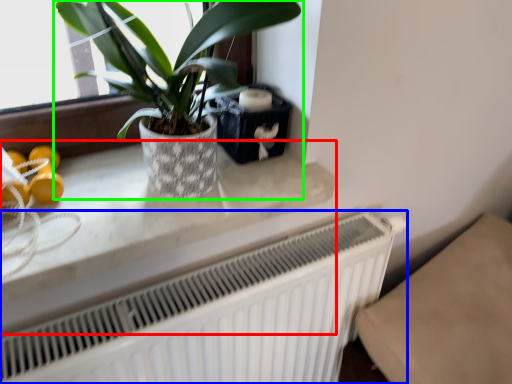
Question: Estimate the real-world distances between objects in this image. Which object is closer to counter top (highlighted by a red box), radiator (highlighted by a blue box) or houseplant (highlighted by a green box)?

Choices:
 (A) radiator
 (B) houseplant

Answer: (A)